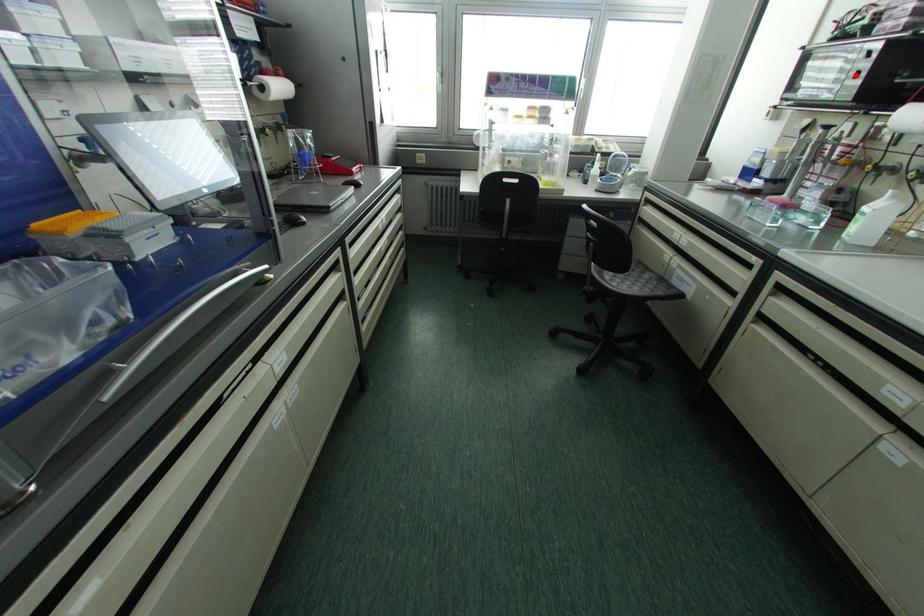
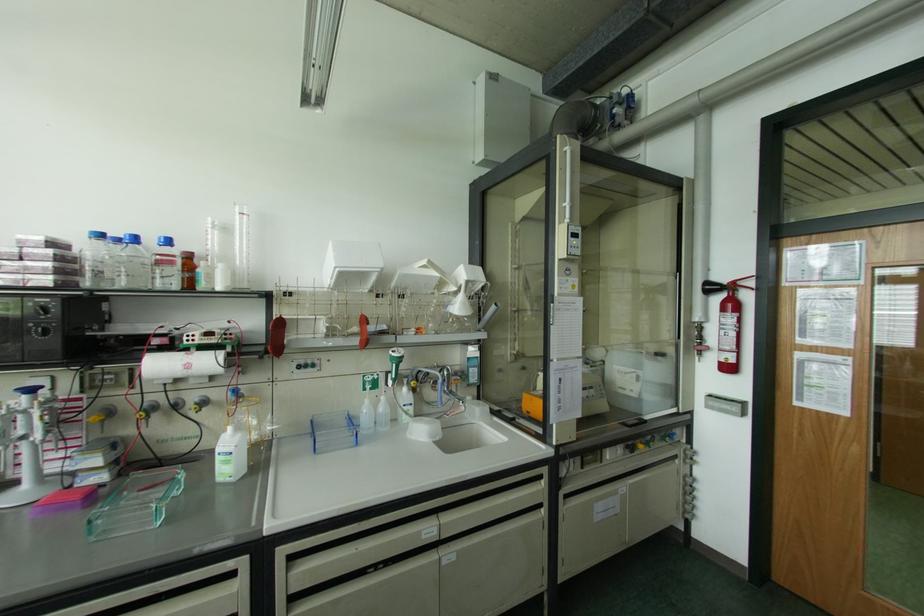
Where in the second image is the point corresponding to the highlighted location from the first image?

(44, 333)